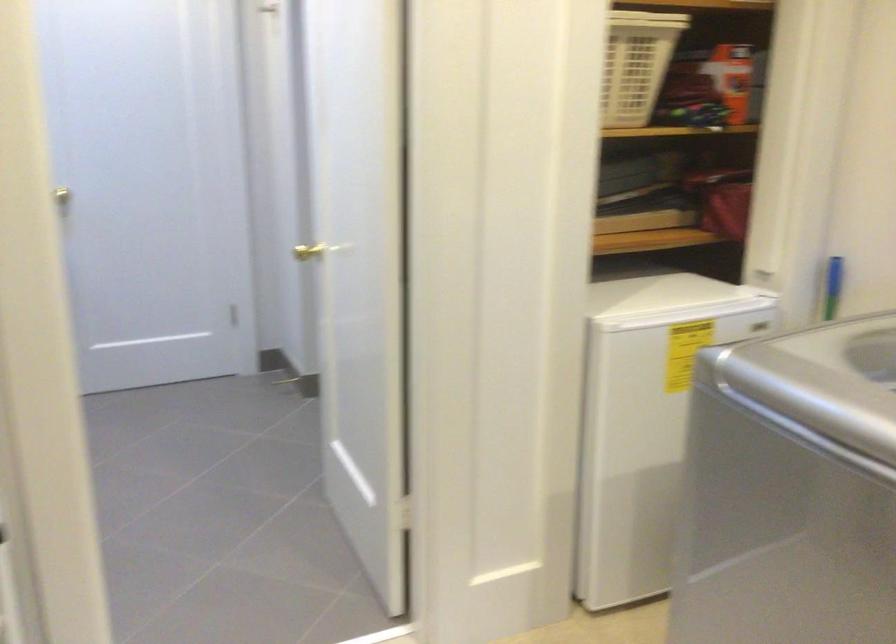
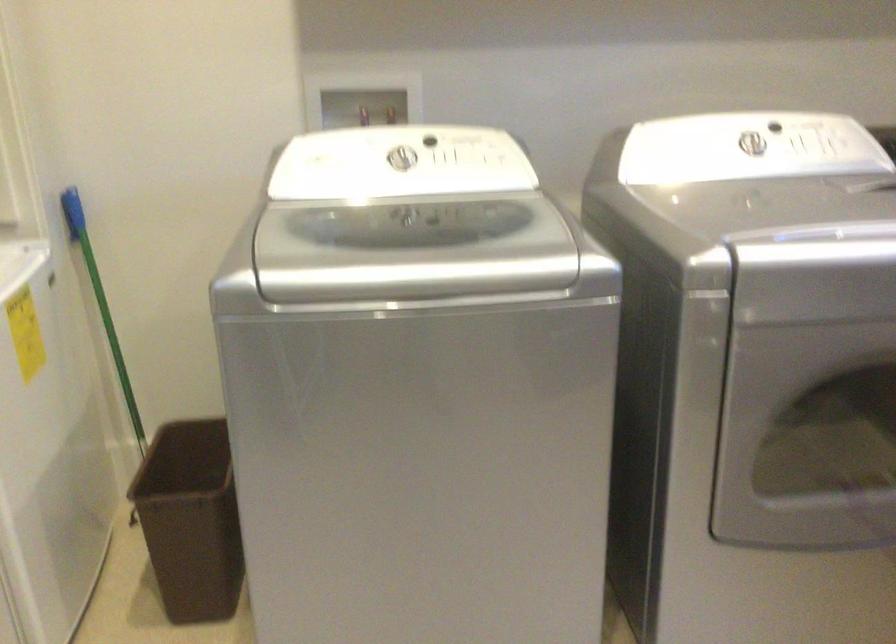
Looking at this image, the first image is from the beginning of the video and the second image is from the end. How did the camera likely rotate when shooting the video?

The camera's rotation is toward right-down.